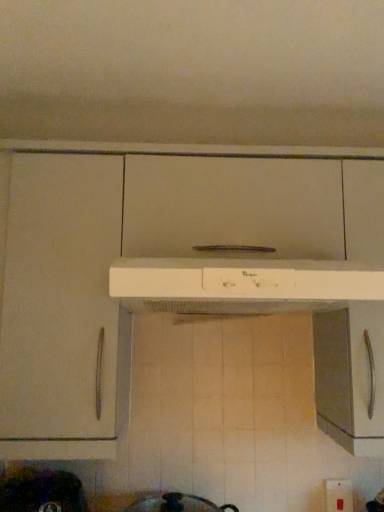
Question: From a real-world perspective, relative to white plastic range hood at center, is white plastic electric outlet at lower right vertically above or below?

Choices:
 (A) above
 (B) below

Answer: (B)

Question: Would you say white plastic electric outlet at lower right is inside or outside white plastic range hood at center?

Choices:
 (A) outside
 (B) inside

Answer: (A)

Question: Estimate the real-world distances between objects in this image. Which object is closer to the white plastic electric outlet at lower right?

Choices:
 (A) metallic dark gray pot at lower left
 (B) white plastic range hood at center

Answer: (B)

Question: Which object is the farthest from the metallic dark gray pot at lower left?

Choices:
 (A) white plastic electric outlet at lower right
 (B) white plastic range hood at center

Answer: (A)